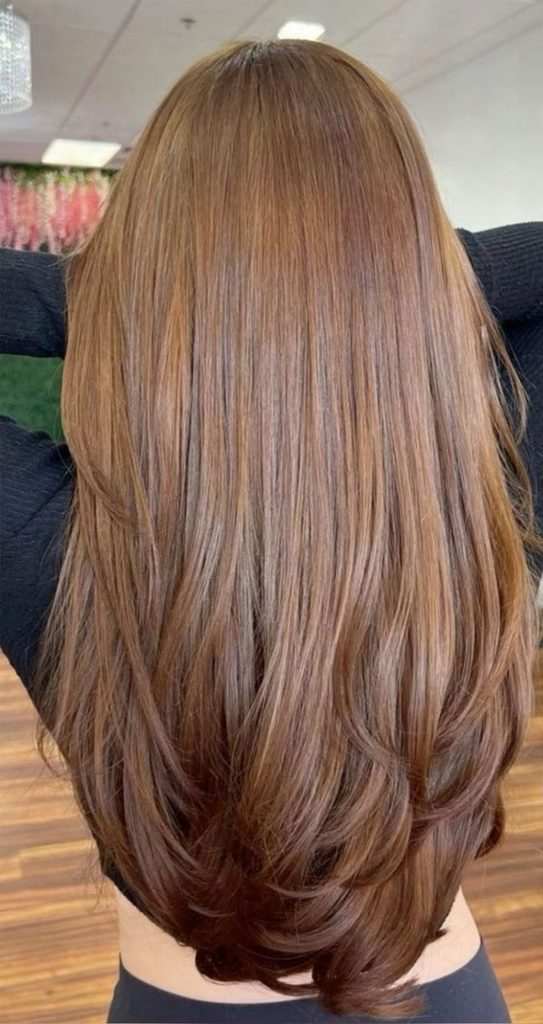
Where is `light gray painted wall`? This screenshot has height=1024, width=543. light gray painted wall is located at coordinates (510, 163).